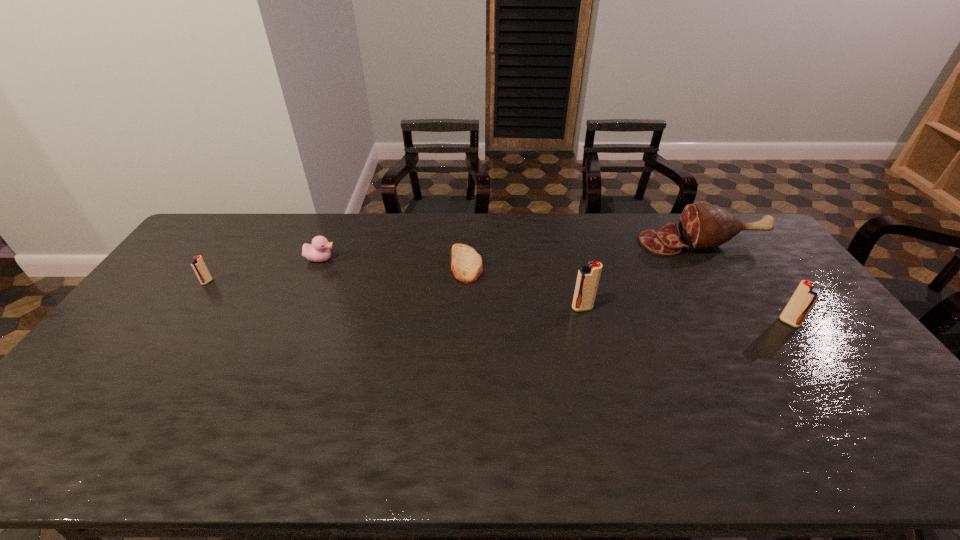
Identify the location of object that is positioned at the left edge. (198, 265).

This screenshot has height=540, width=960. I want to click on igniter present at the right edge, so click(805, 296).

This screenshot has width=960, height=540. In order to click on ham that is at the right edge in this screenshot , I will do `click(702, 226)`.

Find the location of `object at the far right corner`. object at the far right corner is located at coordinates (702, 226).

Locate an element on the screen. free space at the far edge of the desktop is located at coordinates (473, 241).

At what (x,y) coordinates should I click in order to perform the action: click on vacant area at the near edge of the desktop. Please return your answer as a coordinate pair (x, y). Looking at the image, I should click on (444, 399).

The image size is (960, 540). Identify the location of free space at the right edge of the desktop. (816, 371).

Where is `vacant space that's between the second object from left to right and the shortest object`? This screenshot has height=540, width=960. vacant space that's between the second object from left to right and the shortest object is located at coordinates (394, 262).

Find the location of a particular element. The width and height of the screenshot is (960, 540). vacant point located between the shortest object and the nearest igniter is located at coordinates (628, 293).

At what (x,y) coordinates should I click in order to perform the action: click on empty space that is in between the second nearest object and the shortest object. Please return your answer as a coordinate pair (x, y). Looking at the image, I should click on (524, 286).